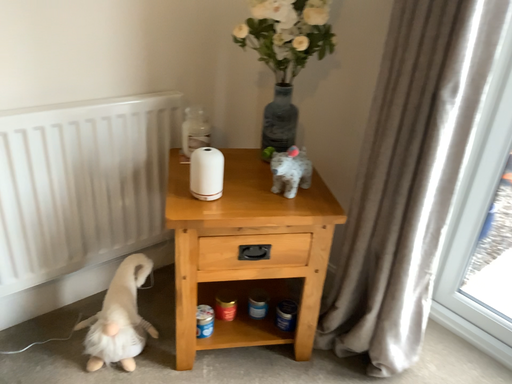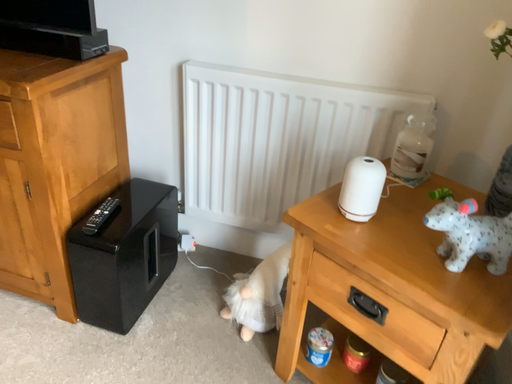
Question: Which way did the camera rotate in the video?

Choices:
 (A) rotated left
 (B) rotated right

Answer: (A)